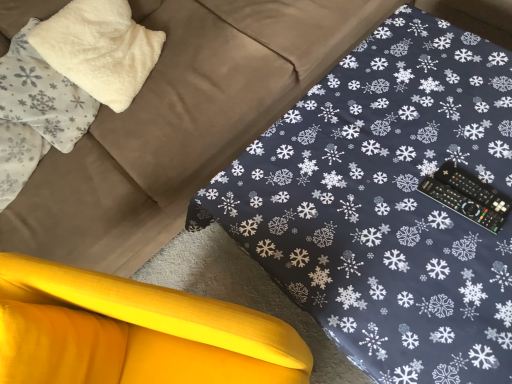
Question: From the image's perspective, is yellow fabric cushion at lower left below white fluffy pillow at upper left, which is the 2th pillow in right-to-left order?

Choices:
 (A) no
 (B) yes

Answer: (B)

Question: Are yellow fabric cushion at lower left and white fluffy pillow at upper left, which is counted as the 1th pillow, starting from the left, far apart?

Choices:
 (A) yes
 (B) no

Answer: (B)

Question: Is yellow fabric cushion at lower left aimed at white fluffy pillow at upper left, which is the 2th pillow in right-to-left order?

Choices:
 (A) yes
 (B) no

Answer: (B)

Question: Is yellow fabric cushion at lower left positioned with its back to white fluffy pillow at upper left, which is the 2th pillow in right-to-left order?

Choices:
 (A) yes
 (B) no

Answer: (B)

Question: Is yellow fabric cushion at lower left next to white fluffy pillow at upper left, which is the 2th pillow in right-to-left order?

Choices:
 (A) no
 (B) yes

Answer: (A)

Question: From a real-world perspective, is white fluffy pillow at upper left, which is the 2th pillow in right-to-left order, physically located above or below white fluffy pillow at upper left, which ranks as the 2th pillow in left-to-right order?

Choices:
 (A) above
 (B) below

Answer: (A)

Question: Does point (6, 92) appear closer or farther from the camera than point (117, 76)?

Choices:
 (A) farther
 (B) closer

Answer: (B)

Question: Based on their sizes in the image, would you say white fluffy pillow at upper left, which is counted as the 1th pillow, starting from the left, is bigger or smaller than white fluffy pillow at upper left, the first pillow when ordered from right to left?

Choices:
 (A) small
 (B) big

Answer: (A)

Question: From the image's perspective, is white fluffy pillow at upper left, which is counted as the 1th pillow, starting from the left, positioned above or below white fluffy pillow at upper left, the first pillow when ordered from right to left?

Choices:
 (A) above
 (B) below

Answer: (B)

Question: Choose the correct answer: Is black plastic remote at right inside white fluffy pillow at upper left, which is counted as the 1th pillow, starting from the left, or outside it?

Choices:
 (A) inside
 (B) outside

Answer: (B)

Question: In the image, is black plastic remote at right positioned in front of or behind white fluffy pillow at upper left, which is the 2th pillow in right-to-left order?

Choices:
 (A) behind
 (B) front

Answer: (B)

Question: From a real-world perspective, is black plastic remote at right physically located above or below white fluffy pillow at upper left, which is counted as the 1th pillow, starting from the left?

Choices:
 (A) below
 (B) above

Answer: (A)

Question: From the image's perspective, relative to white fluffy pillow at upper left, which is the 2th pillow in right-to-left order, is black plastic remote at right above or below?

Choices:
 (A) above
 (B) below

Answer: (B)

Question: Is yellow fabric cushion at lower left to the left or to the right of white fluffy pillow at upper left, which ranks as the 2th pillow in left-to-right order, in the image?

Choices:
 (A) right
 (B) left

Answer: (A)

Question: Based on their sizes in the image, would you say yellow fabric cushion at lower left is bigger or smaller than white fluffy pillow at upper left, which ranks as the 2th pillow in left-to-right order?

Choices:
 (A) big
 (B) small

Answer: (A)